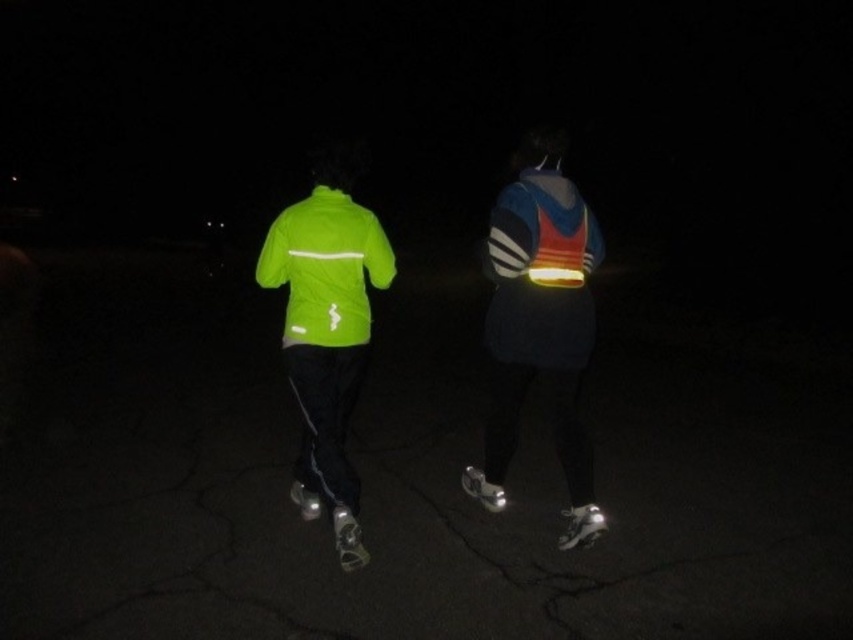
You are a pedestrian trying to cross the road at night. You see two points of light in front of you at coordinates point (552, 177) and point (549, 250). Which point is closer to you?

Point (552, 177) is closer to you because it is further to the camera than point (549, 250).

You are a pedestrian trying to cross the road at night. You see two people ahead of you on the sidewalk. One is wearing a neon green fabric jacket at upper left and the other a reflective blue jacket at center. Which person is closer to you?

The reflective blue jacket at center is closer to you because the neon green fabric jacket at upper left is behind it.